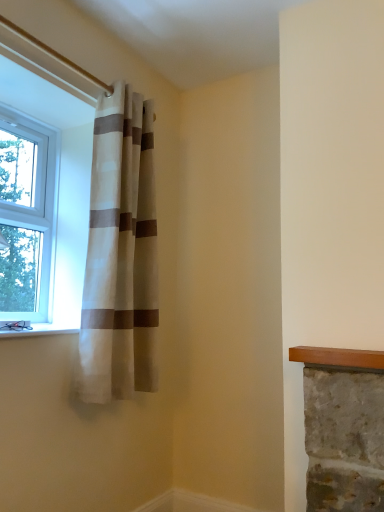
Question: Looking at their shapes, would you say white stone window sill at lower left is wider or thinner than beige/white striped curtain at upper left?

Choices:
 (A) wide
 (B) thin

Answer: (A)

Question: Is white stone window sill at lower left in front of or behind beige/white striped curtain at upper left in the image?

Choices:
 (A) behind
 (B) front

Answer: (B)

Question: Which is farther from the white stone window sill at lower left?

Choices:
 (A) clear glass window at left
 (B) beige/white striped curtain at upper left

Answer: (A)

Question: Which is nearer to the clear glass window at left?

Choices:
 (A) white stone window sill at lower left
 (B) beige/white striped curtain at upper left

Answer: (B)